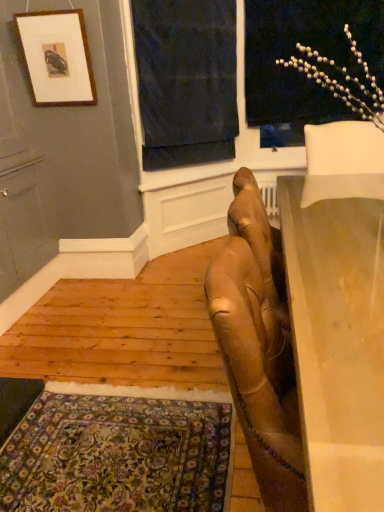
At what (x,y) coordinates should I click in order to perform the action: click on blank space situated above matte wooden picture frame at upper left (from a real-world perspective). Please return your answer as a coordinate pair (x, y). Looking at the image, I should click on (49, 11).